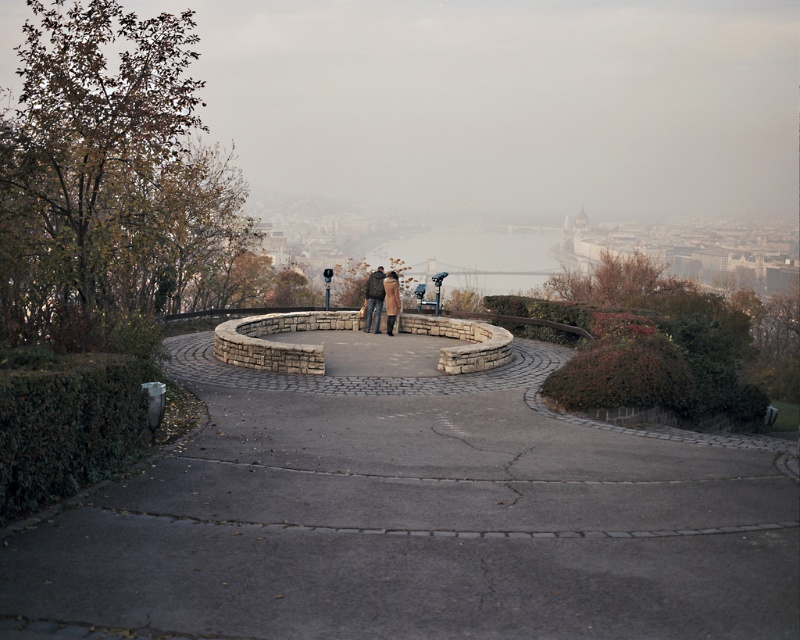
Is gray concrete path at center smaller than brown leather coat at center?

Actually, gray concrete path at center might be larger than brown leather coat at center.

Does gray concrete path at center have a lesser width compared to brown leather coat at center?

In fact, gray concrete path at center might be wider than brown leather coat at center.

Between point (540, 593) and point (398, 310), which one is positioned behind?

Positioned behind is point (398, 310).

Locate an element on the screen. This screenshot has width=800, height=640. gray concrete path at center is located at coordinates (410, 515).

Can you confirm if brown leather coat at center is thinner than brown wool coat at center?

In fact, brown leather coat at center might be wider than brown wool coat at center.

Identify the location of brown leather coat at center. (381, 298).

In the scene shown: Can you confirm if gray concrete path at center is bigger than brown wool coat at center?

Yes.

Can you confirm if gray concrete path at center is taller than brown wool coat at center?

No, gray concrete path at center is not taller than brown wool coat at center.

Is point (246, 484) positioned before point (396, 298)?

Yes, point (246, 484) is in front of point (396, 298).

Image resolution: width=800 pixels, height=640 pixels. What are the coordinates of `gray concrete path at center` in the screenshot? It's located at (410, 515).